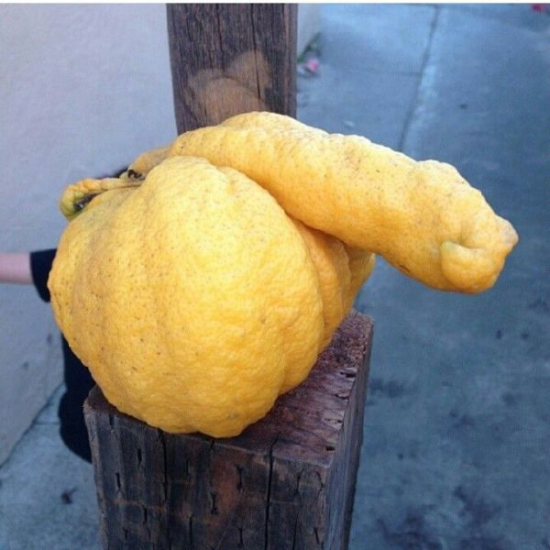
You are a GUI agent. You are given a task and a screenshot of the screen. Output one action in this format:
    pyautogui.click(x=<x>, y=<y>)
    Task: Click on the wood post
    The image size is (550, 550).
    Given the screenshot: What is the action you would take?
    pyautogui.click(x=285, y=472)